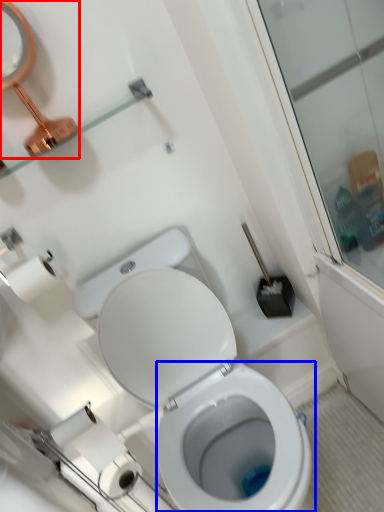
Question: Which point is further to the camera, mirror (highlighted by a red box) or bidet (highlighted by a blue box)?

Choices:
 (A) mirror
 (B) bidet

Answer: (B)